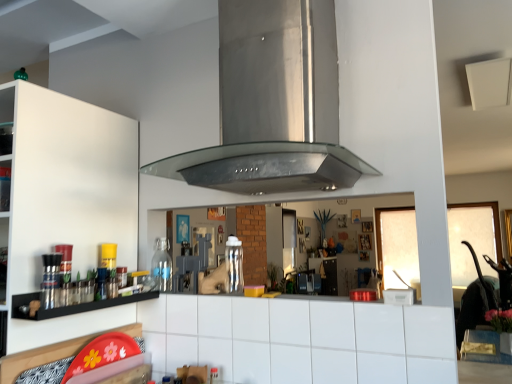
Question: From a real-world perspective, is transparent glass bottle at left, which is counted as the 2th bottle, starting from the right, on white matte cabinet at left?

Choices:
 (A) yes
 (B) no

Answer: (B)

Question: From the image's perspective, is transparent glass bottle at left, the 1th bottle from the left, located above white matte cabinet at left?

Choices:
 (A) yes
 (B) no

Answer: (B)

Question: Could you tell me if transparent glass bottle at left, the 1th bottle from the left, is turned towards white matte cabinet at left?

Choices:
 (A) no
 (B) yes

Answer: (A)

Question: Considering the relative sizes of transparent glass bottle at left, the 1th bottle from the left, and white matte cabinet at left in the image provided, is transparent glass bottle at left, the 1th bottle from the left, taller than white matte cabinet at left?

Choices:
 (A) yes
 (B) no

Answer: (B)

Question: Is transparent glass bottle at left, marked as the 2th bottle in a front-to-back arrangement, shorter than white matte cabinet at left?

Choices:
 (A) yes
 (B) no

Answer: (A)

Question: In terms of height, does clear plastic bottle at center, marked as the 2th bottle in a back-to-front arrangement, look taller or shorter compared to stainless steel vent at center?

Choices:
 (A) short
 (B) tall

Answer: (A)

Question: From the image's perspective, is clear plastic bottle at center, which ranks as the 1th bottle in right-to-left order, positioned above or below stainless steel vent at center?

Choices:
 (A) above
 (B) below

Answer: (B)

Question: In terms of size, does clear plastic bottle at center, arranged as the second bottle when viewed from the left, appear bigger or smaller than stainless steel vent at center?

Choices:
 (A) small
 (B) big

Answer: (A)

Question: Is clear plastic bottle at center, arranged as the second bottle when viewed from the left, spatially inside stainless steel vent at center, or outside of it?

Choices:
 (A) inside
 (B) outside

Answer: (B)

Question: Is white matte cabinet at left to the left or to the right of transparent glass bottle at left, marked as the 2th bottle in a front-to-back arrangement, in the image?

Choices:
 (A) left
 (B) right

Answer: (A)

Question: Considering the positions of white matte cabinet at left and transparent glass bottle at left, which is counted as the 2th bottle, starting from the right, in the image, is white matte cabinet at left taller or shorter than transparent glass bottle at left, which is counted as the 2th bottle, starting from the right,?

Choices:
 (A) short
 (B) tall

Answer: (B)

Question: Looking at the image, does white matte cabinet at left seem bigger or smaller compared to transparent glass bottle at left, marked as the 2th bottle in a front-to-back arrangement?

Choices:
 (A) big
 (B) small

Answer: (A)

Question: From the image's perspective, is white matte cabinet at left above or below transparent glass bottle at left, marked as the 2th bottle in a front-to-back arrangement?

Choices:
 (A) below
 (B) above

Answer: (B)

Question: Is transparent glass bottle at left, the 1th bottle from the left, bigger or smaller than stainless steel vent at center?

Choices:
 (A) big
 (B) small

Answer: (B)

Question: Considering the positions of transparent glass bottle at left, the 1th bottle from the left, and stainless steel vent at center in the image, is transparent glass bottle at left, the 1th bottle from the left, wider or thinner than stainless steel vent at center?

Choices:
 (A) thin
 (B) wide

Answer: (A)